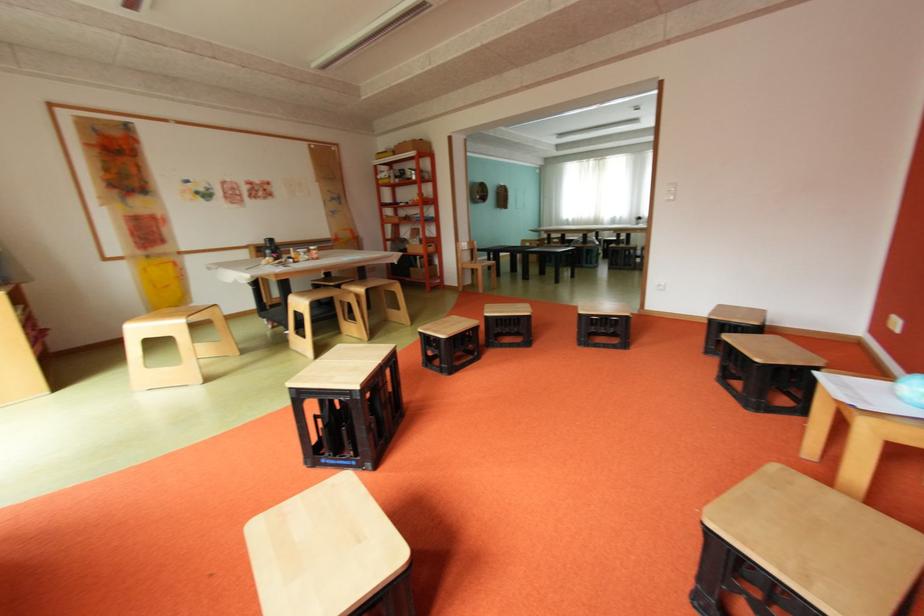
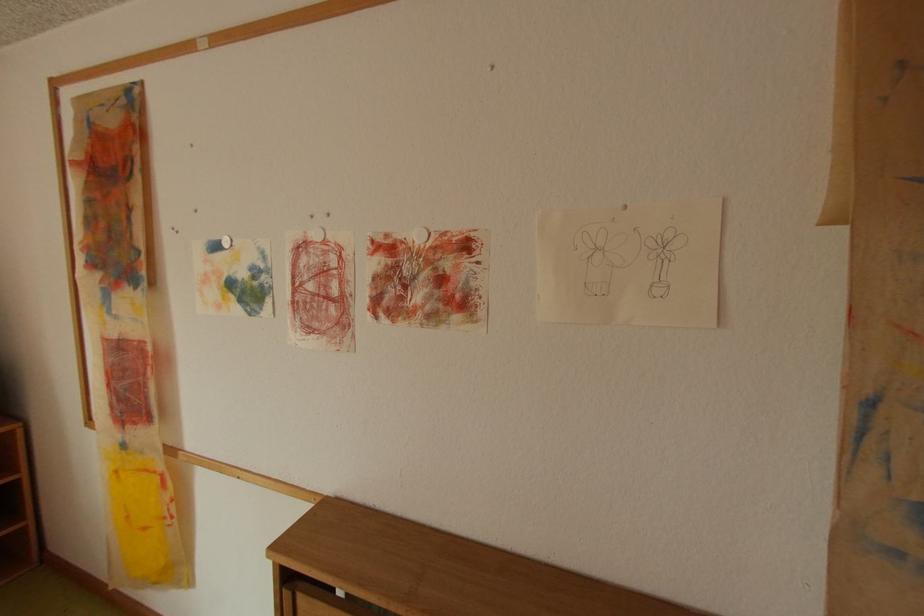
Where in the second image is the point corresponding to point (235, 195) from the first image?

(304, 292)